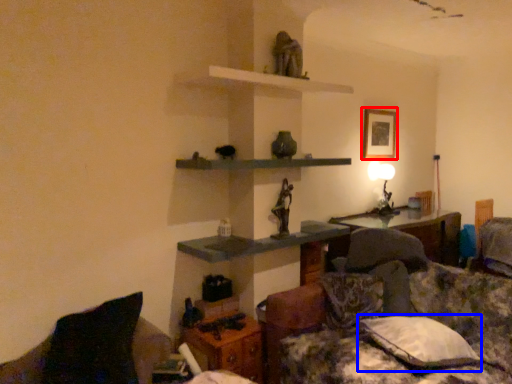
Question: Among these objects, which one is farthest to the camera, picture frame (highlighted by a red box) or pillow (highlighted by a blue box)?

Choices:
 (A) picture frame
 (B) pillow

Answer: (A)